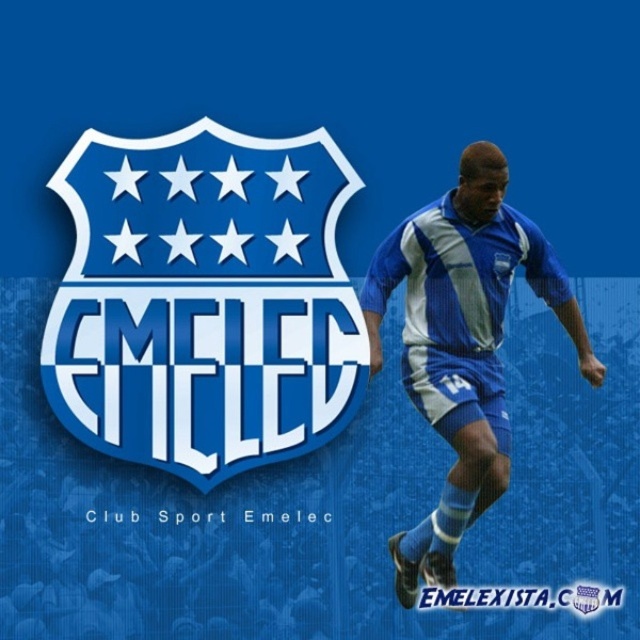
Question: Does blue glossy shield at center have a smaller size compared to blue fabric soccer player at center?

Choices:
 (A) no
 (B) yes

Answer: (B)

Question: Which object is closer to the camera taking this photo?

Choices:
 (A) blue glossy shield at center
 (B) blue fabric soccer player at center

Answer: (B)

Question: Which object appears farthest from the camera in this image?

Choices:
 (A) blue glossy shield at center
 (B) blue fabric soccer player at center

Answer: (A)

Question: Considering the relative positions of blue glossy shield at center and blue fabric soccer player at center in the image provided, where is blue glossy shield at center located with respect to blue fabric soccer player at center?

Choices:
 (A) left
 (B) right

Answer: (A)

Question: Is blue glossy shield at center positioned behind blue fabric soccer player at center?

Choices:
 (A) yes
 (B) no

Answer: (A)